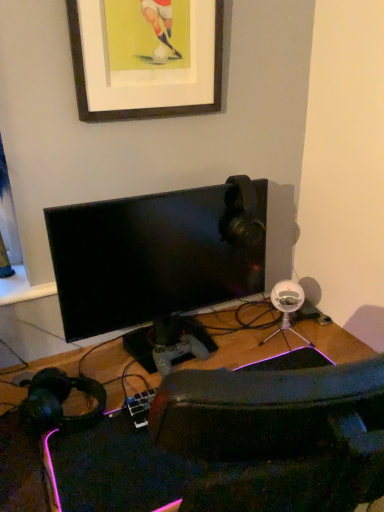
I want to click on free point to the left of black matte headphones at lower left, so click(10, 404).